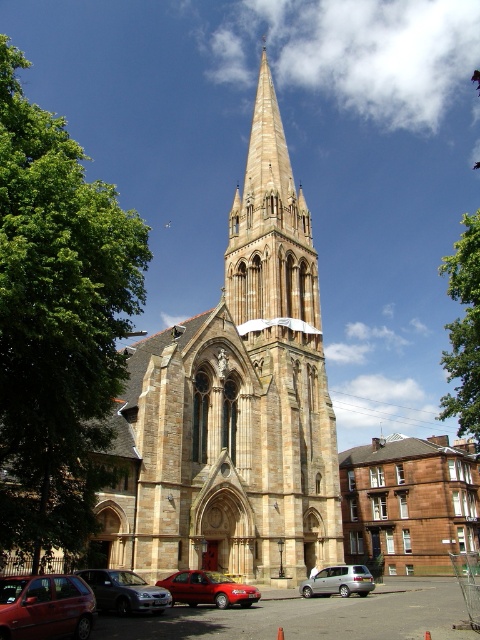
Where is `green leafy tree at left`? The height and width of the screenshot is (640, 480). green leafy tree at left is located at coordinates pyautogui.click(x=57, y=321).

Does green leafy tree at left have a greater height compared to silver metallic van at lower center?

Yes, green leafy tree at left is taller than silver metallic van at lower center.

At what (x,y) coordinates should I click in order to perform the action: click on green leafy tree at left. Please return your answer as a coordinate pair (x, y). Looking at the image, I should click on (57, 321).

Locate an element on the screen. Image resolution: width=480 pixels, height=640 pixels. green leafy tree at left is located at coordinates (57, 321).

Does green leafy tree at upper right appear under matte silver hatchback at lower left?

Incorrect, green leafy tree at upper right is not positioned below matte silver hatchback at lower left.

Is point (455, 410) positioned behind point (131, 595)?

Yes, point (455, 410) is behind point (131, 595).

Where is `green leafy tree at upper right`? green leafy tree at upper right is located at coordinates (464, 330).

Does matte silver hatchback at lower left appear on the left side of silver metallic van at lower center?

Yes, matte silver hatchback at lower left is to the left of silver metallic van at lower center.

Who is positioned more to the left, matte silver hatchback at lower left or silver metallic van at lower center?

Positioned to the left is matte silver hatchback at lower left.

Is point (163, 602) closer to camera compared to point (337, 572)?

Yes, point (163, 602) is closer to viewer.

You are a GUI agent. You are given a task and a screenshot of the screen. Output one action in this format:
    pyautogui.click(x=<x>, y=<y>)
    Task: Click on the matte silver hatchback at lower left
    
    Given the screenshot: What is the action you would take?
    pyautogui.click(x=124, y=592)